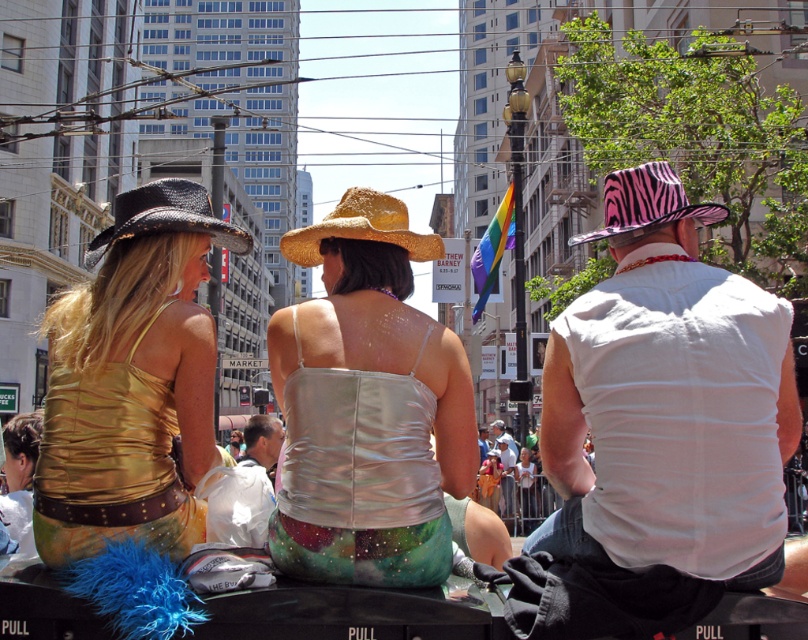
You are a photographer trying to capture a clear shot of both the gold shiny tank top at upper left and the black woven cowboy hat at left. Based on their positions, will the tank top block the view of the cowboy hat in your photo?

The gold shiny tank top at upper left is in front of the black woven cowboy hat at left, so the tank top will block the view of the cowboy hat in the photo.

You are a photographer standing on the parade route and want to capture both the gold shiny tank top at upper left and the straw hat at center in a single photo. The camera you have can only focus on objects within a 10 feet range. Will you be able to include both in the same frame without moving?

The gold shiny tank top at upper left and straw hat at center are 12.15 feet apart from each other, which exceeds the camera focus range of 10 feet. Therefore, you cannot include both in the same frame without moving.

You are a photographer trying to capture the perfect shot of the gold shiny tank top at upper left and the straw hat at center. Based on their positions, which object is positioned more to the left?

The gold shiny tank top at upper left is positioned more to the left than the straw hat at center.